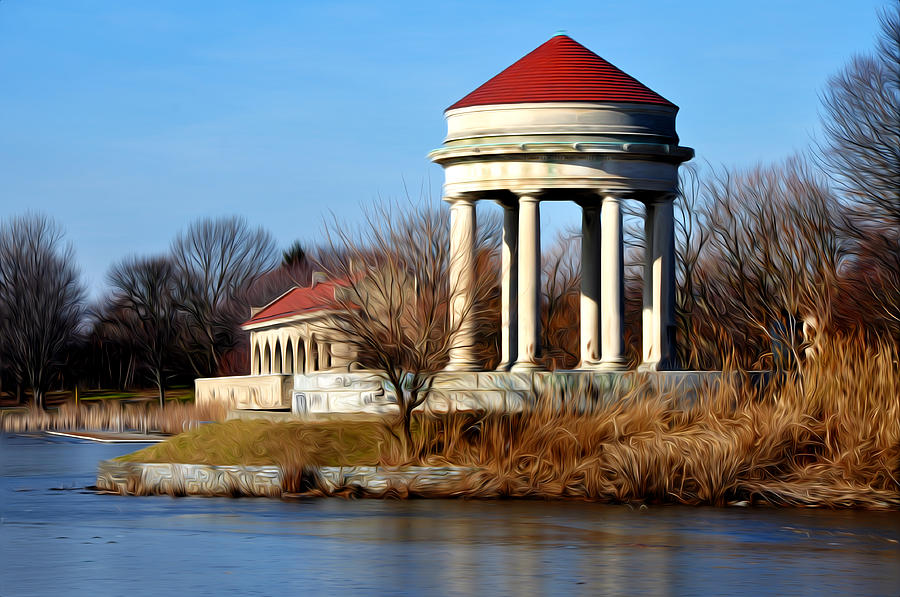
At what (x,y) coordinates should I click in order to perform the action: click on wall. Please return your answer as a coordinate pair (x, y). This screenshot has width=900, height=597. Looking at the image, I should click on (699, 390), (564, 389), (508, 384), (447, 383), (362, 378), (302, 384).